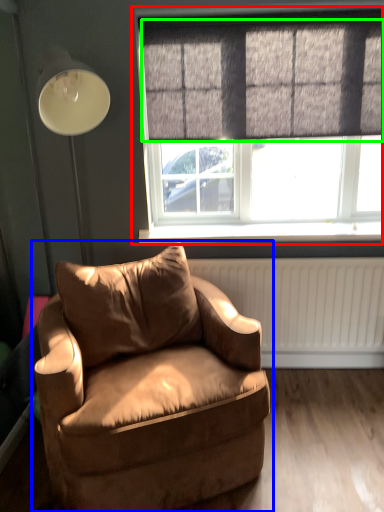
Question: Based on their relative distances, which object is farther from window (highlighted by a red box)? Choose from chair (highlighted by a blue box) and curtain (highlighted by a green box).

Choices:
 (A) chair
 (B) curtain

Answer: (A)